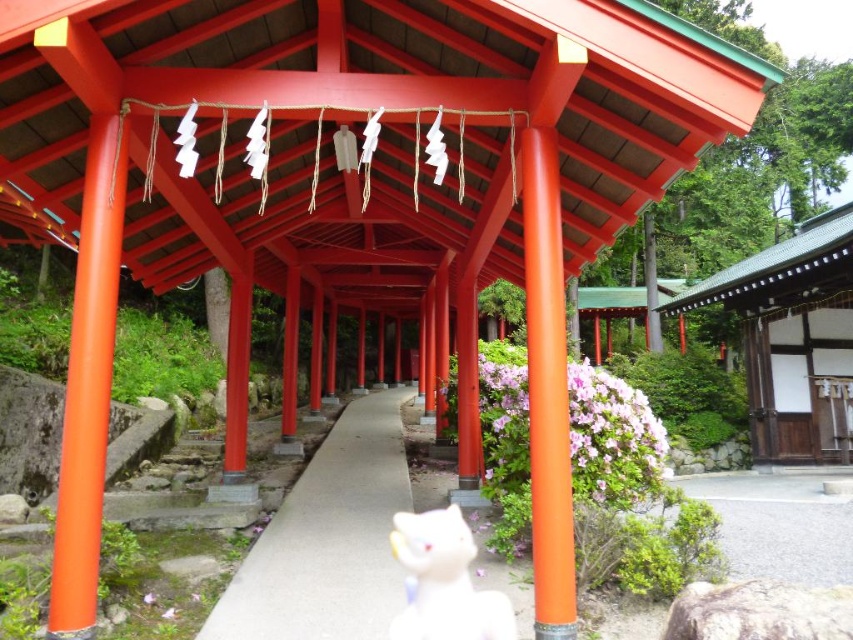
Is point (379, 556) closer to viewer compared to point (741, 304)?

Yes, point (379, 556) is closer to viewer.

Looking at this image, which is more to the left, concrete at center or green shingled roof at upper right?

concrete at center

At what (x,y) coordinates should I click in order to perform the action: click on concrete at center. Please return your answer as a coordinate pair (x, y). Looking at the image, I should click on (328, 538).

This screenshot has width=853, height=640. Find the location of `concrete at center`. concrete at center is located at coordinates (328, 538).

Which is more to the right, concrete at center or white glossy cat at center?

white glossy cat at center

Is point (322, 515) more distant than point (434, 522)?

Yes, it is.

Between point (334, 582) and point (427, 602), which one is positioned behind?

The point (334, 582) is behind.

In order to click on concrete at center in this screenshot , I will do `click(328, 538)`.

Who is more forward, (735, 276) or (480, 624)?

Point (480, 624) is more forward.

Is point (758, 307) behind point (434, 580)?

Yes, it is behind point (434, 580).

I want to click on green shingled roof at upper right, so click(793, 339).